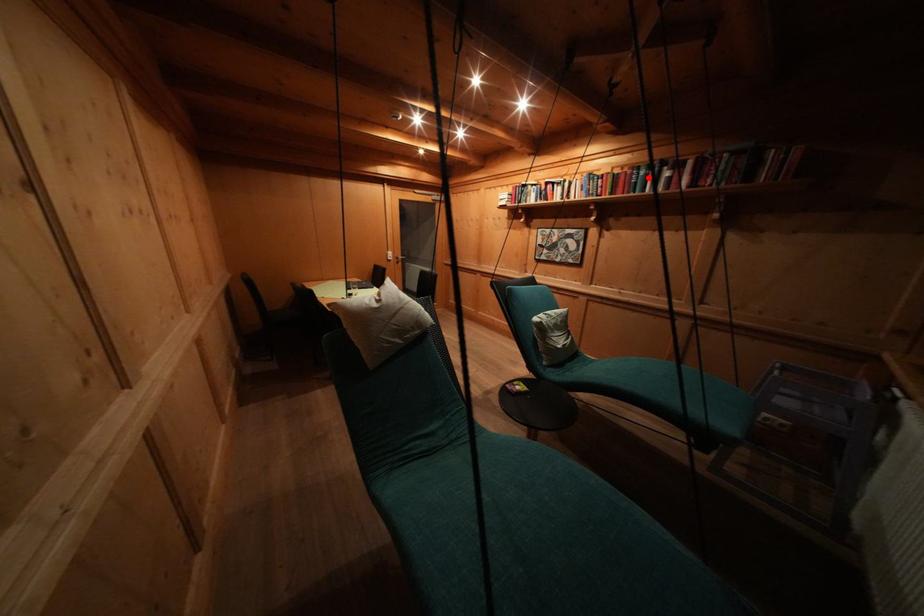
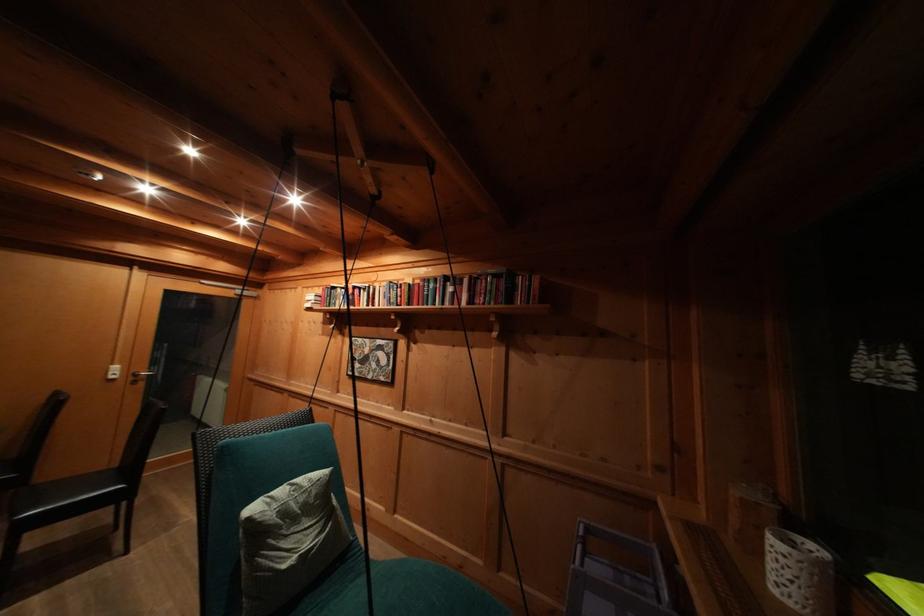
In the second image, find the point that corresponds to the highlighted location in the first image.

(438, 291)